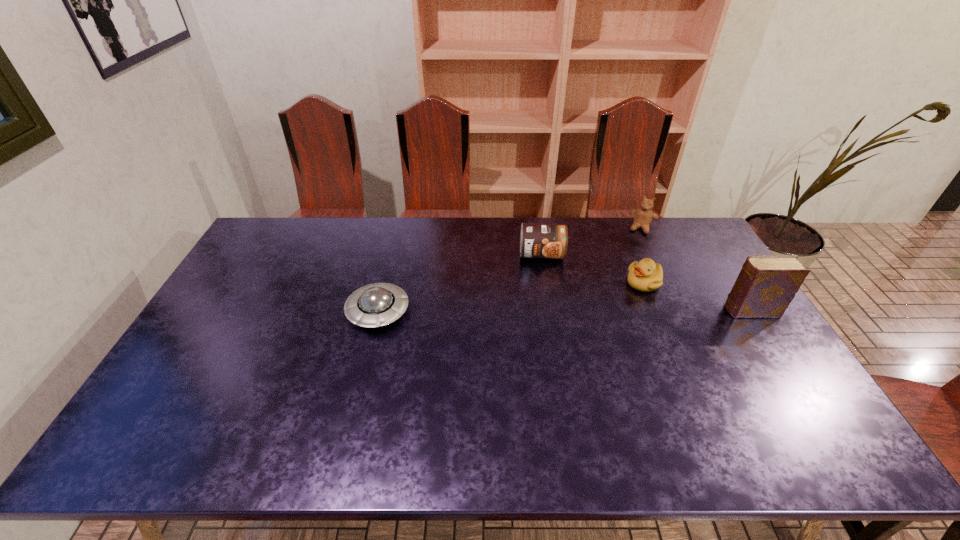
What are the coordinates of `free space located on the spine side of the diary` in the screenshot? It's located at (649, 310).

Locate an element on the screen. This screenshot has height=540, width=960. vacant region located on the spine side of the diary is located at coordinates (669, 310).

This screenshot has height=540, width=960. In order to click on vacant space located 0.220m on the front-facing side of the duckling in this screenshot , I will do `click(587, 321)`.

In order to click on vacant space situated 0.080m on the front-facing side of the duckling in this screenshot , I will do tap(617, 301).

At what (x,y) coordinates should I click in order to perform the action: click on vacant space situated on the front-facing side of the duckling. Please return your answer as a coordinate pair (x, y). The image size is (960, 540). Looking at the image, I should click on (612, 304).

Where is `vacant space located on the front label of the fourth object from right to left`? Image resolution: width=960 pixels, height=540 pixels. vacant space located on the front label of the fourth object from right to left is located at coordinates [543, 288].

This screenshot has width=960, height=540. I want to click on vacant space situated on the front label of the fourth object from right to left, so click(x=546, y=319).

Find the location of a particular element. blank area located on the front label of the fourth object from right to left is located at coordinates (548, 353).

This screenshot has width=960, height=540. I want to click on free space located on the face of the teddy bear, so click(x=624, y=293).

Locate an element on the screen. The width and height of the screenshot is (960, 540). free space located on the face of the teddy bear is located at coordinates (625, 289).